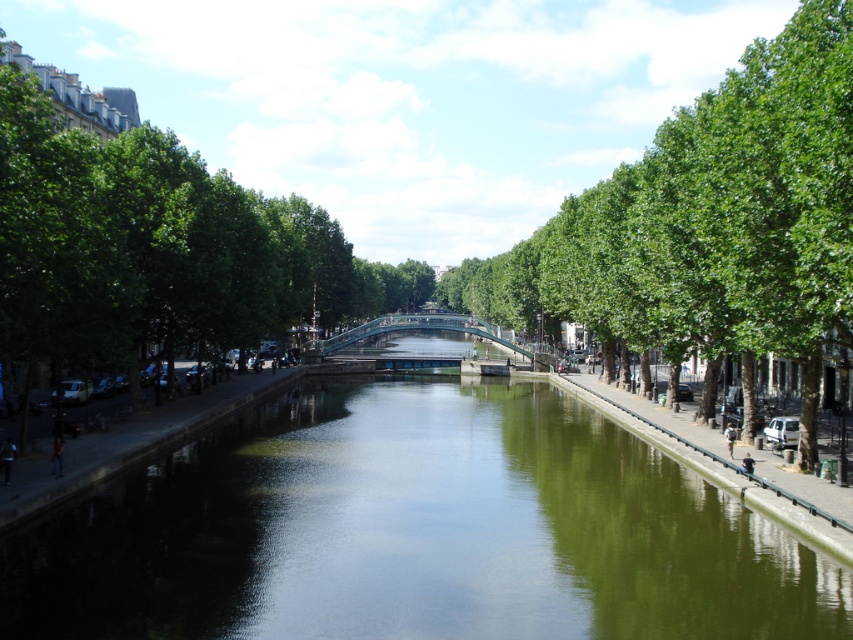
Question: Can you confirm if green reflective water at center is positioned below green leafy tree at left?

Choices:
 (A) no
 (B) yes

Answer: (B)

Question: Which point appears farthest from the camera in this image?

Choices:
 (A) (831, 236)
 (B) (503, 634)
 (C) (257, 272)

Answer: (C)

Question: Does green reflective water at center have a larger size compared to green leafy tree at left?

Choices:
 (A) no
 (B) yes

Answer: (A)

Question: Which object is closer to the camera taking this photo?

Choices:
 (A) green reflective water at center
 (B) green leafy tree at left
 (C) green leafy tree at right

Answer: (A)

Question: Which of the following is the farthest from the observer?

Choices:
 (A) (815, 385)
 (B) (67, 253)

Answer: (A)

Question: From the image, what is the correct spatial relationship of green leafy tree at right in relation to green leafy tree at left?

Choices:
 (A) right
 (B) left

Answer: (A)